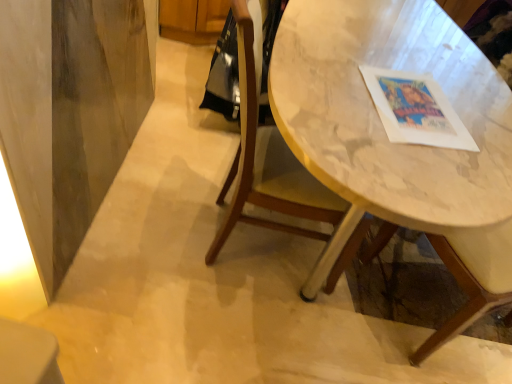
Find the location of a particular element. This screenshot has width=512, height=384. free space in front of wooden chair at center is located at coordinates (220, 337).